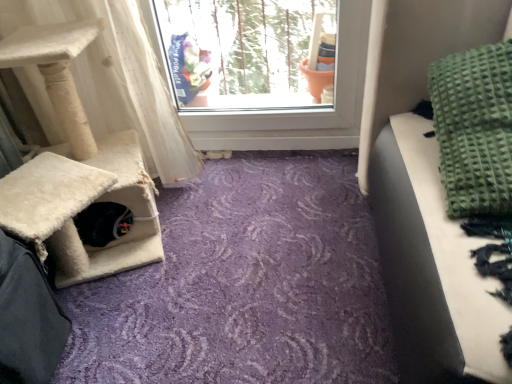
Question: From the image's perspective, would you say green textured blanket at upper right is shown under white textured curtain at left?

Choices:
 (A) yes
 (B) no

Answer: (B)

Question: Can you see green textured blanket at upper right touching white textured curtain at left?

Choices:
 (A) no
 (B) yes

Answer: (A)

Question: Does green textured blanket at upper right have a smaller size compared to white textured curtain at left?

Choices:
 (A) no
 (B) yes

Answer: (B)

Question: From a real-world perspective, is green textured blanket at upper right positioned under white textured curtain at left based on gravity?

Choices:
 (A) yes
 (B) no

Answer: (B)

Question: From the image's perspective, is green textured blanket at upper right over white textured curtain at left?

Choices:
 (A) no
 (B) yes

Answer: (B)

Question: Is green textured blanket at upper right thinner than white textured curtain at left?

Choices:
 (A) no
 (B) yes

Answer: (B)

Question: From a real-world perspective, does white textured curtain at left stand above green textured blanket at upper right?

Choices:
 (A) yes
 (B) no

Answer: (B)

Question: From the image's perspective, is white textured curtain at left on top of green textured blanket at upper right?

Choices:
 (A) yes
 (B) no

Answer: (B)

Question: Considering the relative sizes of white textured curtain at left and green textured blanket at upper right in the image provided, is white textured curtain at left wider than green textured blanket at upper right?

Choices:
 (A) yes
 (B) no

Answer: (A)

Question: Does white textured curtain at left come in front of green textured blanket at upper right?

Choices:
 (A) no
 (B) yes

Answer: (A)

Question: From the image's perspective, is white textured curtain at left beneath green textured blanket at upper right?

Choices:
 (A) yes
 (B) no

Answer: (A)

Question: Is white textured curtain at left not close to green textured blanket at upper right?

Choices:
 (A) yes
 (B) no

Answer: (B)

Question: Considering their positions, is white textured curtain at left located in front of or behind green textured blanket at upper right?

Choices:
 (A) behind
 (B) front

Answer: (A)